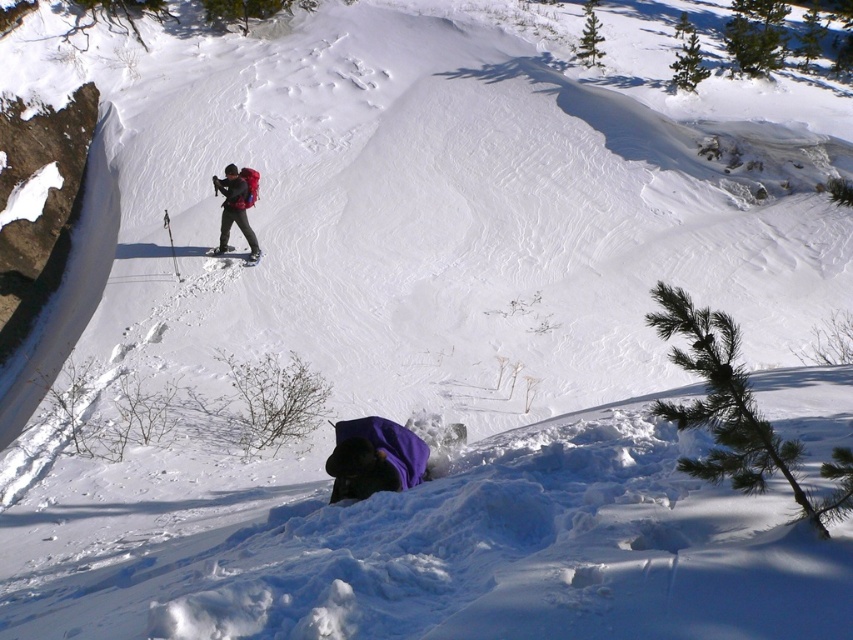
Does matte red backpack at center have a larger size compared to matte black ski at center?

Correct, matte red backpack at center is larger in size than matte black ski at center.

In the scene shown: Which of these two, matte red backpack at center or matte black ski at center, stands shorter?

Standing shorter between the two is matte black ski at center.

Where is `matte red backpack at center`? The width and height of the screenshot is (853, 640). matte red backpack at center is located at coordinates (236, 205).

Is green needle-like pine at lower right above matte red backpack at center?

Incorrect, green needle-like pine at lower right is not positioned above matte red backpack at center.

Looking at this image, does green needle-like pine at lower right have a greater width compared to matte red backpack at center?

Indeed, green needle-like pine at lower right has a greater width compared to matte red backpack at center.

Find the location of a particular element. The width and height of the screenshot is (853, 640). green needle-like pine at lower right is located at coordinates (735, 412).

Which of these two, green needle-like pine at lower right or matte black ski at center, stands taller?

green needle-like pine at lower right

Can you confirm if green needle-like pine at lower right is thinner than matte black ski at center?

No.

Describe the element at coordinates (735, 412) in the screenshot. This screenshot has height=640, width=853. I see `green needle-like pine at lower right` at that location.

Where is `green needle-like pine at lower right`? This screenshot has width=853, height=640. green needle-like pine at lower right is located at coordinates (735, 412).